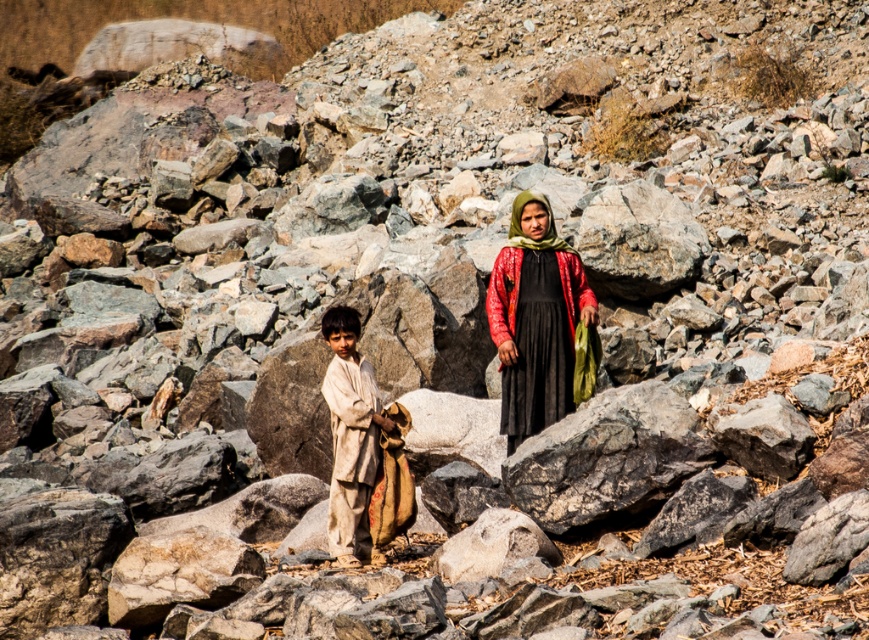
Is light beige fabric at center taller than green textured shawl at center?

Yes.

Where is `light beige fabric at center`? The height and width of the screenshot is (640, 869). light beige fabric at center is located at coordinates (350, 438).

Can you confirm if red textured fabric at center is positioned to the right of green textured shawl at center?

Incorrect, red textured fabric at center is not on the right side of green textured shawl at center.

Can you confirm if red textured fabric at center is positioned below green textured shawl at center?

Correct, red textured fabric at center is located below green textured shawl at center.

Image resolution: width=869 pixels, height=640 pixels. I want to click on red textured fabric at center, so click(x=535, y=320).

Which is behind, point (521, 221) or point (363, 381)?

The point (521, 221) is more distant.

Can you confirm if red textured fabric at center is positioned above light beige fabric at center?

Yes.

Locate an element on the screen. This screenshot has height=640, width=869. red textured fabric at center is located at coordinates (535, 320).